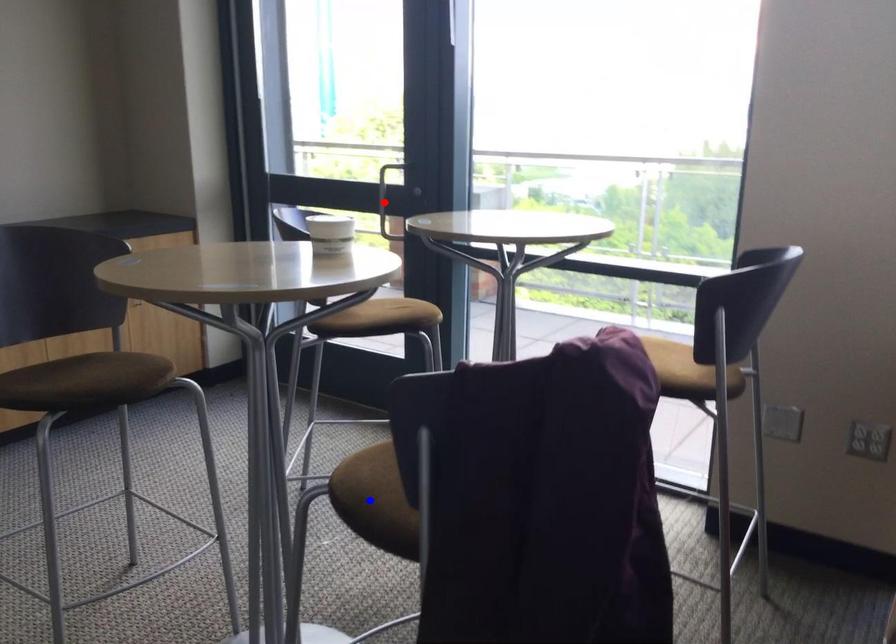
Question: Which of the two points in the image is closer to the camera?

Choices:
 (A) Blue point is closer.
 (B) Red point is closer.

Answer: (A)